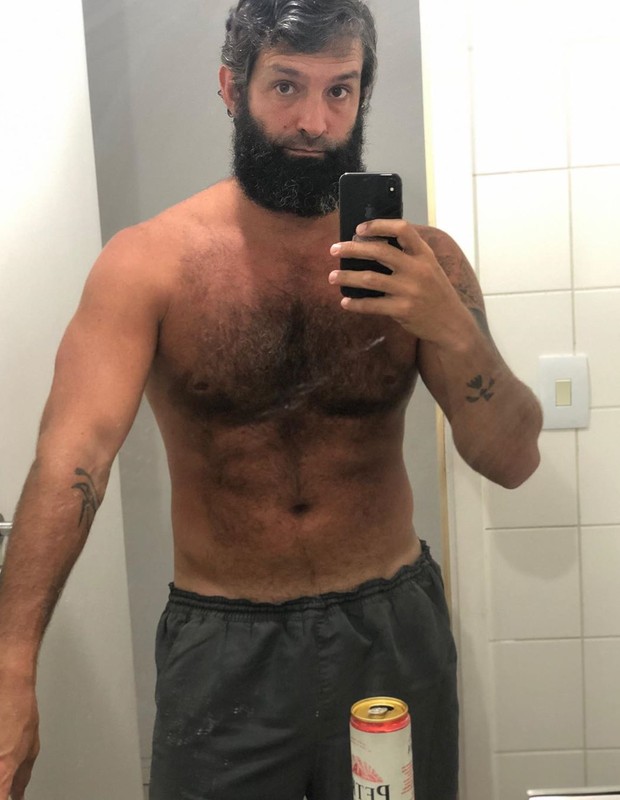
Locate an element on the screen. The height and width of the screenshot is (800, 620). bathroom wall tile is located at coordinates (508, 22), (600, 37), (601, 236), (539, 262), (550, 566), (601, 589), (604, 760), (528, 749).